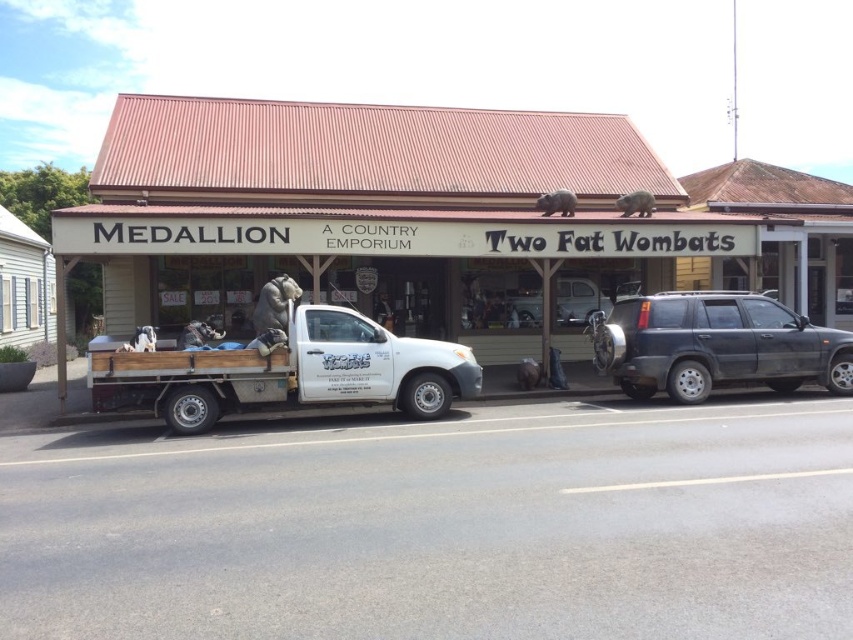
Is white matte truck at lower left below white matte truck at center?

Incorrect, white matte truck at lower left is not positioned below white matte truck at center.

Is white matte truck at lower left to the right of white matte truck at center from the viewer's perspective?

Yes, white matte truck at lower left is to the right of white matte truck at center.

Is point (62, 236) positioned before point (114, 394)?

No, (62, 236) is further to viewer.

The height and width of the screenshot is (640, 853). Find the location of `white matte truck at lower left`. white matte truck at lower left is located at coordinates (433, 218).

Is white matte truck at lower left above satin silver truck at center?

Yes.

Which is behind, point (744, 173) or point (846, 353)?

Positioned behind is point (744, 173).

Image resolution: width=853 pixels, height=640 pixels. In order to click on white matte truck at lower left in this screenshot , I will do `click(433, 218)`.

Does white matte truck at center come in front of satin silver truck at center?

That is True.

Which is in front, point (129, 380) or point (735, 324)?

Positioned in front is point (129, 380).

Who is more distant from viewer, (229, 352) or (724, 305)?

The point (724, 305) is behind.

The height and width of the screenshot is (640, 853). Find the location of `white matte truck at center`. white matte truck at center is located at coordinates (289, 372).